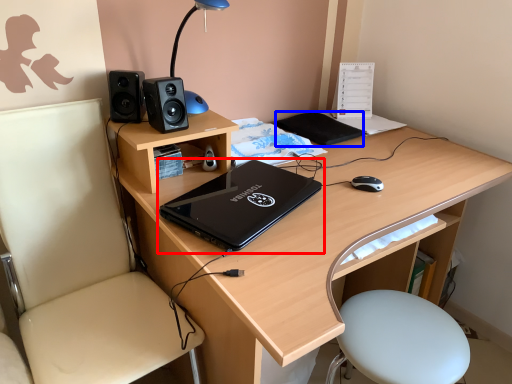
Question: Which point is further to the camera, laptop (highlighted by a red box) or notepad (highlighted by a blue box)?

Choices:
 (A) laptop
 (B) notepad

Answer: (B)